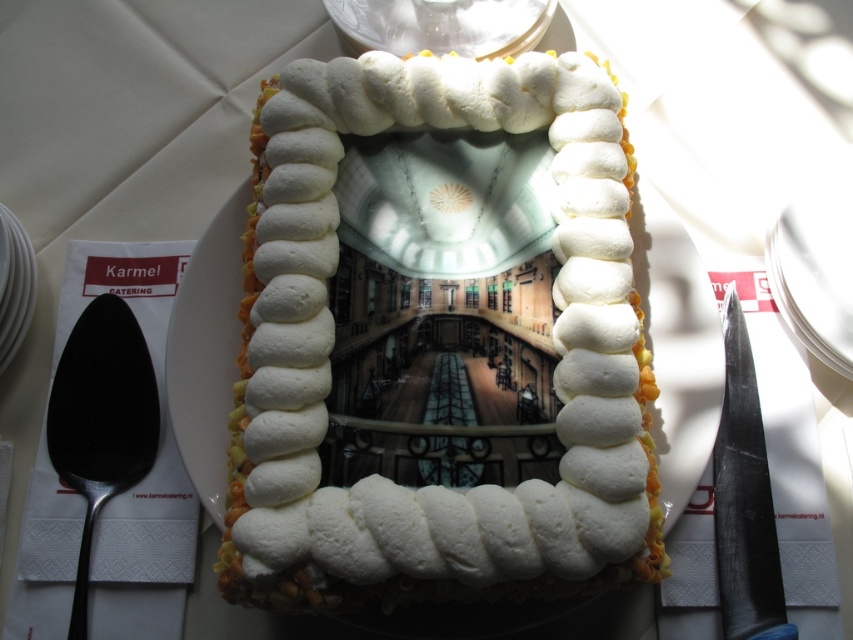
Which of these two, polished silver spoon at left or white ceramic plate at left, stands shorter?

Standing shorter between the two is white ceramic plate at left.

Is point (120, 403) positioned after point (16, 340)?

No, (120, 403) is closer to viewer.

Where is `polished silver spoon at left`? The width and height of the screenshot is (853, 640). polished silver spoon at left is located at coordinates (102, 420).

Does white fluffy cake at center have a smaller size compared to white paper plate at right?

No, white fluffy cake at center is not smaller than white paper plate at right.

Which is above, white fluffy cake at center or white paper plate at right?

white paper plate at right is above.

The image size is (853, 640). Describe the element at coordinates (334, 339) in the screenshot. I see `white fluffy cake at center` at that location.

Locate an element on the screen. This screenshot has width=853, height=640. white fluffy cake at center is located at coordinates (334, 339).

Who is taller, white paper plate at right or white ceramic plate at left?

With more height is white paper plate at right.

Which of these two, white paper plate at right or white ceramic plate at left, stands shorter?

Standing shorter between the two is white ceramic plate at left.

The height and width of the screenshot is (640, 853). Find the location of `white paper plate at right`. white paper plate at right is located at coordinates (810, 296).